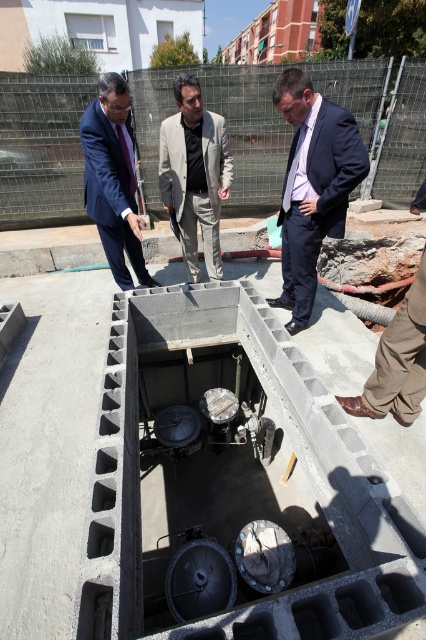
Question: Does dark blue suit at center appear on the left side of dark blue suit at left?

Choices:
 (A) yes
 (B) no

Answer: (B)

Question: Which is nearer to the light gray suit at center?

Choices:
 (A) dark blue suit at center
 (B) dark blue suit at left

Answer: (B)

Question: Can you confirm if dark blue suit at center is positioned below dark blue suit at left?

Choices:
 (A) yes
 (B) no

Answer: (A)

Question: Which is nearer to the light gray suit at center?

Choices:
 (A) dark blue suit at left
 (B) dark blue suit at center

Answer: (A)

Question: Among these objects, which one is nearest to the camera?

Choices:
 (A) light gray suit at center
 (B) dark blue suit at center

Answer: (B)

Question: Is dark blue suit at center to the left of light gray suit at center from the viewer's perspective?

Choices:
 (A) no
 (B) yes

Answer: (A)